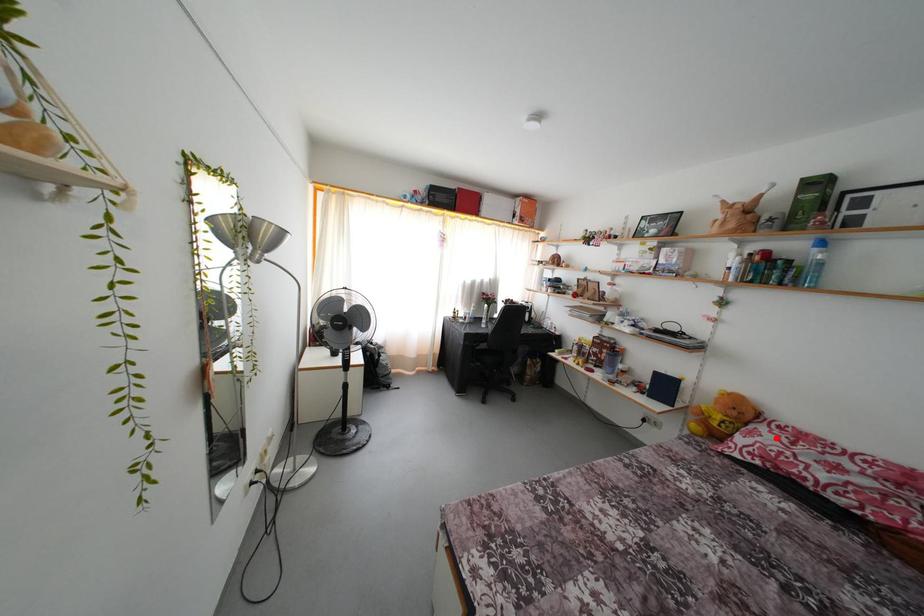
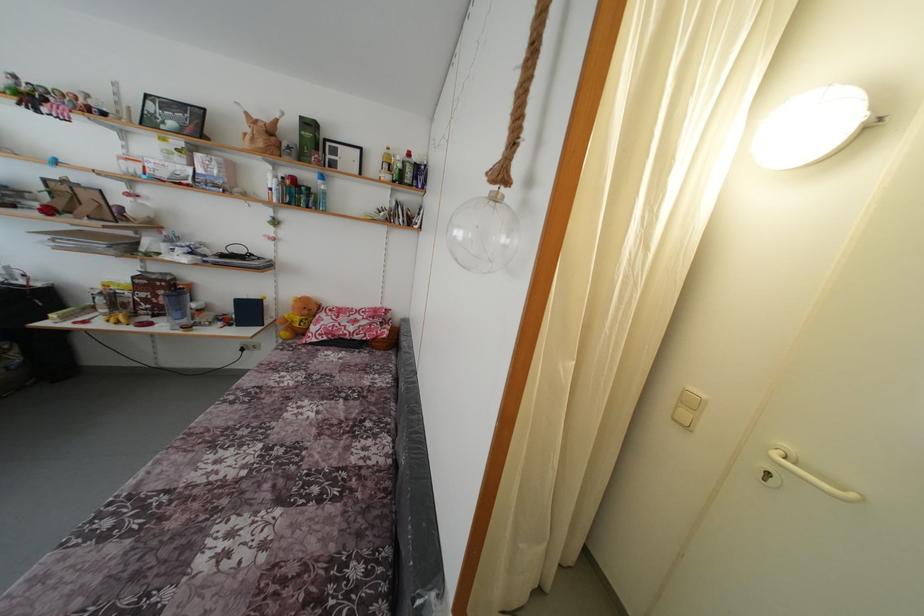
Locate, in the second image, the point that corresponds to the highlighted location in the first image.

(332, 321)